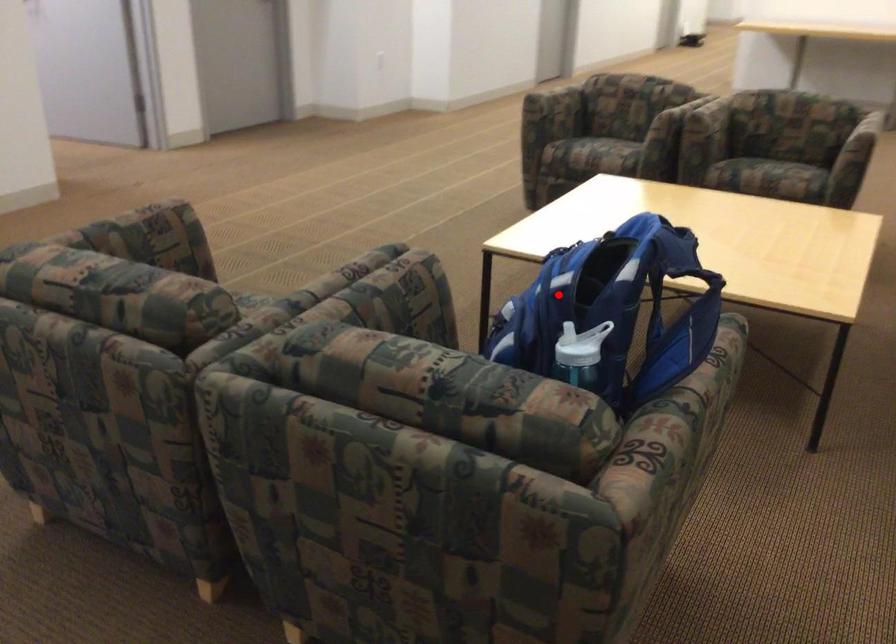
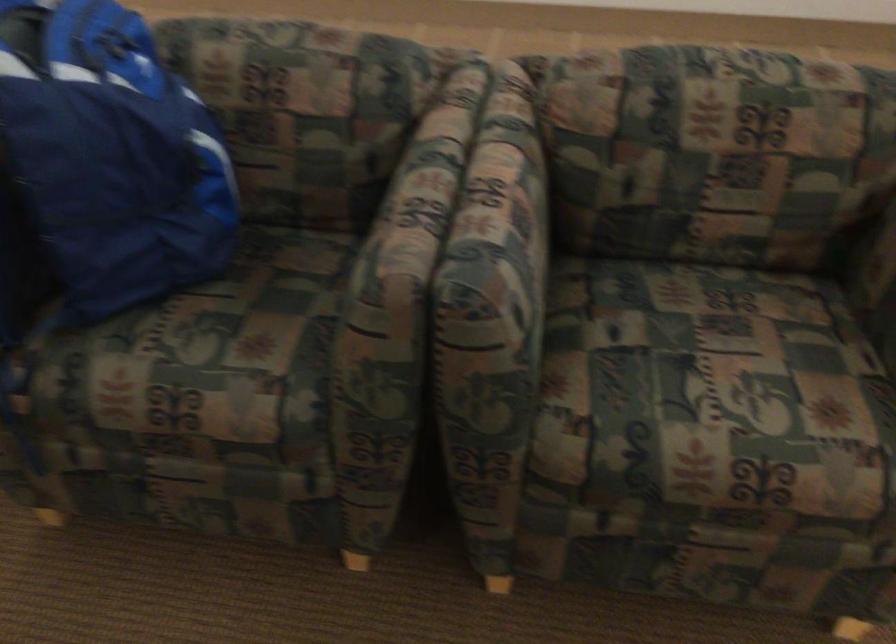
Find the pixel in the second image that matches the highlighted location in the first image.

(112, 155)